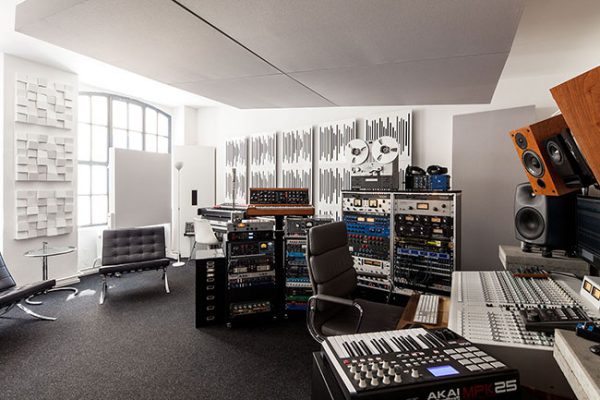
The width and height of the screenshot is (600, 400). I want to click on black computer chair, so click(x=343, y=294).